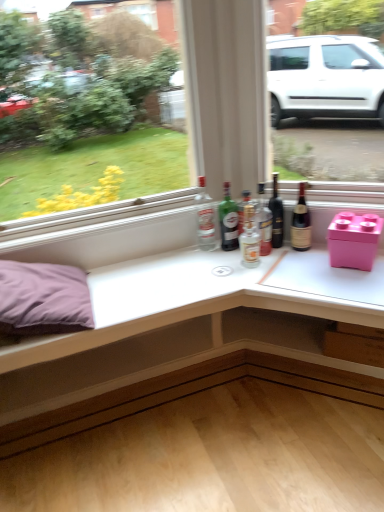
You are a GUI agent. You are given a task and a screenshot of the screen. Output one action in this format:
    pyautogui.click(x=<x>, y=<y>)
    Task: Click on the vacant space that is to the left of brown glass bottle at right, the 1th bottle viewed from the right
    The image size is (384, 512).
    Given the screenshot: What is the action you would take?
    pyautogui.click(x=273, y=257)